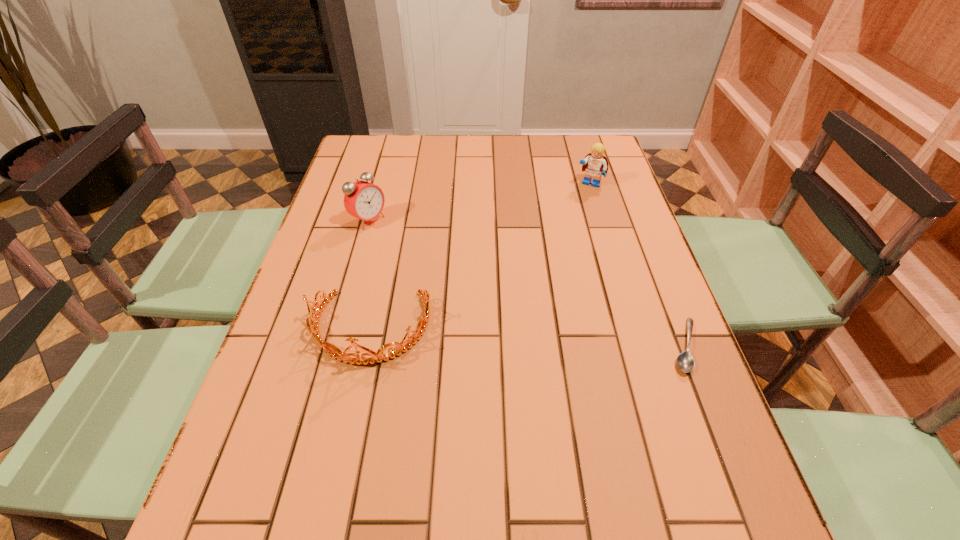
Locate an element on the screen. The height and width of the screenshot is (540, 960). vacant space situated 0.260m on the front-facing side of the Lego is located at coordinates (560, 240).

I want to click on free space located 0.100m on the front-facing side of the third nearest object, so click(405, 243).

Image resolution: width=960 pixels, height=540 pixels. Identify the location of vacant space located 0.210m on the front-facing side of the third nearest object. (435, 261).

Image resolution: width=960 pixels, height=540 pixels. In order to click on vacant space situated on the front-facing side of the third nearest object in this screenshot , I will do `click(400, 240)`.

Locate an element on the screen. This screenshot has width=960, height=540. tiara at the left edge is located at coordinates (336, 353).

Identify the location of alarm clock situated at the left edge. The height and width of the screenshot is (540, 960). (363, 200).

Identify the location of soupspoon that is positioned at the right edge. The image size is (960, 540). (685, 361).

Where is `Lego at the right edge`? The image size is (960, 540). Lego at the right edge is located at coordinates (595, 164).

The height and width of the screenshot is (540, 960). In order to click on blank space at the far edge in this screenshot , I will do `click(513, 154)`.

In order to click on free location at the near edge of the desktop in this screenshot , I will do `click(388, 461)`.